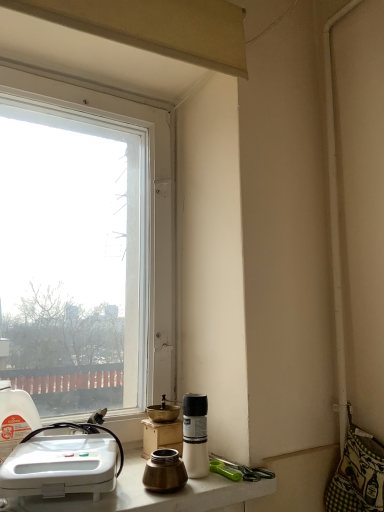
Question: Is brass metallic coffee cup at lower center bigger than translucent plastic bottle at left, marked as the first bottle in a left-to-right arrangement?

Choices:
 (A) no
 (B) yes

Answer: (A)

Question: Does brass metallic coffee cup at lower center have a smaller size compared to translucent plastic bottle at left, the 2th bottle from the right?

Choices:
 (A) yes
 (B) no

Answer: (A)

Question: Is brass metallic coffee cup at lower center wider than translucent plastic bottle at left, the 2th bottle from the right?

Choices:
 (A) no
 (B) yes

Answer: (A)

Question: Is brass metallic coffee cup at lower center facing towards translucent plastic bottle at left, the 2th bottle from the right?

Choices:
 (A) no
 (B) yes

Answer: (A)

Question: From a real-world perspective, is brass metallic coffee cup at lower center physically above translucent plastic bottle at left, the 2th bottle from the right?

Choices:
 (A) yes
 (B) no

Answer: (B)

Question: From the image's perspective, is brass metallic coffee cup at lower center above translucent plastic bottle at left, the 2th bottle from the right?

Choices:
 (A) yes
 (B) no

Answer: (B)

Question: Is transparent glass window at upper left positioned behind brass metallic coffee cup at lower center?

Choices:
 (A) yes
 (B) no

Answer: (A)

Question: Is transparent glass window at upper left to the right of brass metallic coffee cup at lower center from the viewer's perspective?

Choices:
 (A) yes
 (B) no

Answer: (B)

Question: Does transparent glass window at upper left have a lesser width compared to brass metallic coffee cup at lower center?

Choices:
 (A) no
 (B) yes

Answer: (A)

Question: Does transparent glass window at upper left contain brass metallic coffee cup at lower center?

Choices:
 (A) yes
 (B) no

Answer: (B)

Question: Considering the relative sizes of transparent glass window at upper left and brass metallic coffee cup at lower center in the image provided, is transparent glass window at upper left shorter than brass metallic coffee cup at lower center?

Choices:
 (A) no
 (B) yes

Answer: (A)

Question: Is transparent glass window at upper left positioned before brass metallic coffee cup at lower center?

Choices:
 (A) no
 (B) yes

Answer: (A)

Question: Is white matte bottle at lower center, positioned as the second bottle in left-to-right order, to the right of transparent glass window at upper left from the viewer's perspective?

Choices:
 (A) yes
 (B) no

Answer: (A)